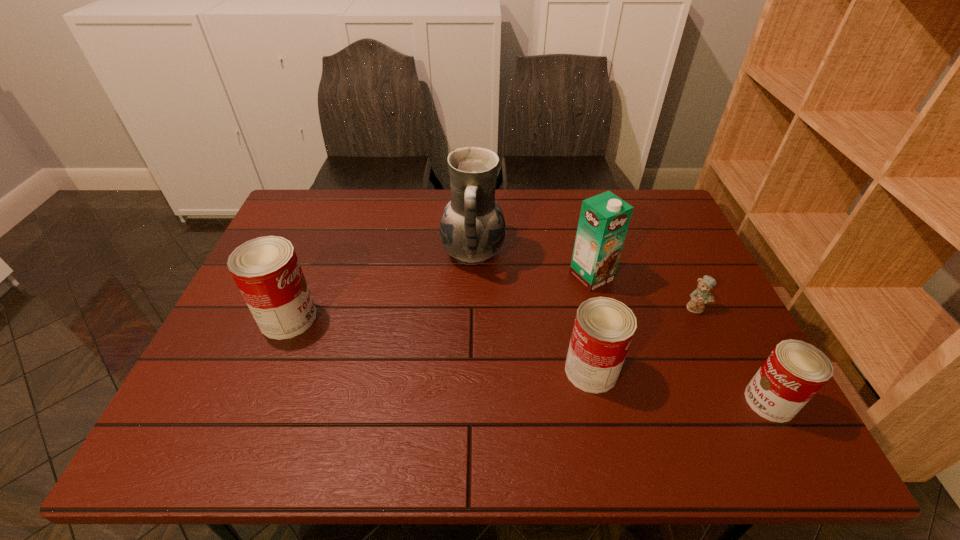
At what (x,y) coordinates should I click in order to perform the action: click on can that is positioned at the right edge. Please return your answer as a coordinate pair (x, y). The height and width of the screenshot is (540, 960). Looking at the image, I should click on (795, 371).

Where is `teddy bear that is at the right edge`? The height and width of the screenshot is (540, 960). teddy bear that is at the right edge is located at coordinates (702, 295).

The width and height of the screenshot is (960, 540). I want to click on object that is at the near right corner, so click(x=795, y=371).

Locate an element on the screen. The height and width of the screenshot is (540, 960). vacant region at the far edge is located at coordinates (389, 227).

At what (x,y) coordinates should I click in order to perform the action: click on blank space at the near edge. Please return your answer as a coordinate pair (x, y). Image resolution: width=960 pixels, height=540 pixels. Looking at the image, I should click on (318, 408).

Image resolution: width=960 pixels, height=540 pixels. In order to click on vacant area at the left edge of the desktop in this screenshot , I will do `click(236, 332)`.

The width and height of the screenshot is (960, 540). I want to click on vacant space at the right edge, so click(642, 246).

Identify the location of blank area at the far left corner. (326, 205).

Locate an element on the screen. Image resolution: width=960 pixels, height=540 pixels. vacant space at the far right corner of the desktop is located at coordinates (662, 221).

Locate an element on the screen. The height and width of the screenshot is (540, 960). vacant space at the near right corner of the desktop is located at coordinates (717, 381).